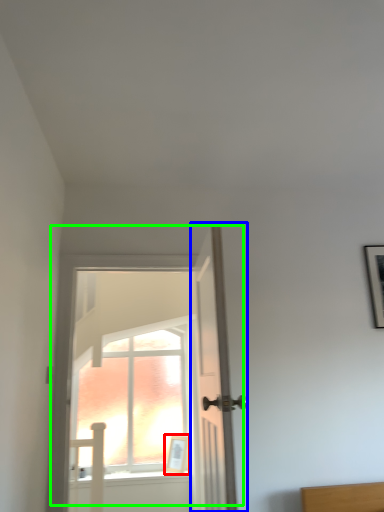
Question: Which object is positioned closest to picture frame (highlighted by a red box)? Select from door (highlighted by a blue box) and door (highlighted by a green box).

Choices:
 (A) door
 (B) door

Answer: (B)